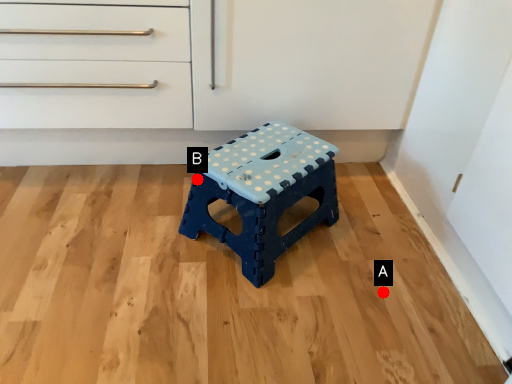
Question: Two points are circled on the image, labeled by A and B beside each circle. Which of the following is the closest to the observer?

Choices:
 (A) A is closer
 (B) B is closer

Answer: (B)